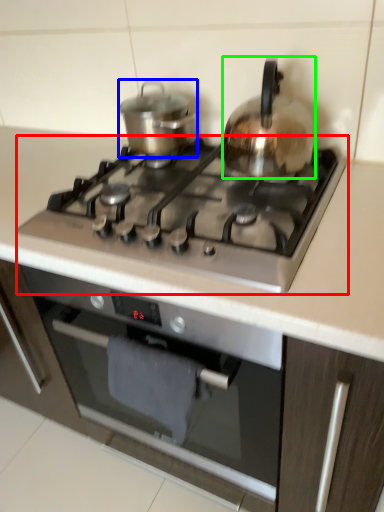
Question: Which object is the farthest from gas stove (highlighted by a red box)? Choose among these: kitchen appliance (highlighted by a blue box) or kitchen appliance (highlighted by a green box).

Choices:
 (A) kitchen appliance
 (B) kitchen appliance

Answer: (A)